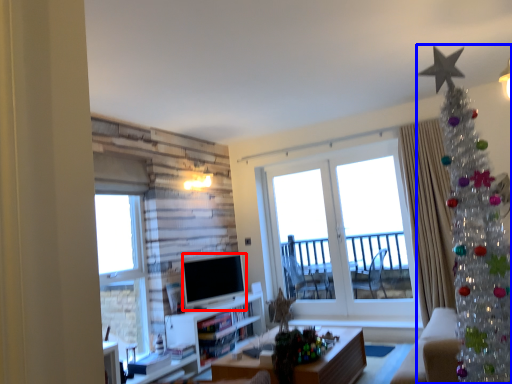
Question: Which object appears closest to the camera in this image, television (highlighted by a red box) or christmas tree (highlighted by a blue box)?

Choices:
 (A) television
 (B) christmas tree

Answer: (B)